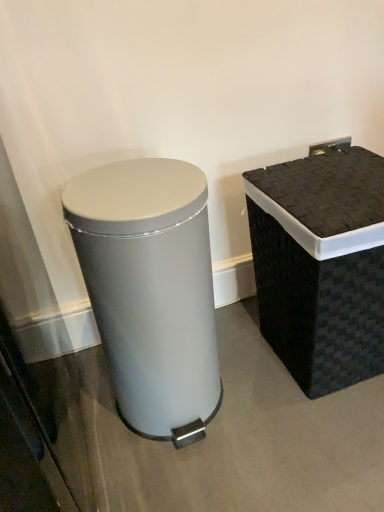
Where is `black woven basket at right, the first waste container viewed from the right`? black woven basket at right, the first waste container viewed from the right is located at coordinates (321, 264).

Describe the element at coordinates (321, 264) in the screenshot. Image resolution: width=384 pixels, height=512 pixels. I see `black woven basket at right, the first waste container viewed from the right` at that location.

At what (x,y) coordinates should I click in order to perform the action: click on satin silver trash can at left, marked as the second waste container in a right-to-left arrangement. Please return your answer as a coordinate pair (x, y). The width and height of the screenshot is (384, 512). Looking at the image, I should click on (151, 289).

What do you see at coordinates (151, 289) in the screenshot? I see `satin silver trash can at left, marked as the second waste container in a right-to-left arrangement` at bounding box center [151, 289].

At what (x,y) coordinates should I click in order to perform the action: click on black woven basket at right, the first waste container viewed from the right. Please return your answer as a coordinate pair (x, y). Image resolution: width=384 pixels, height=512 pixels. Looking at the image, I should click on (321, 264).

Is black woven basket at right, the first waste container viewed from the right, to the left or to the right of satin silver trash can at left, marked as the second waste container in a right-to-left arrangement, in the image?

black woven basket at right, the first waste container viewed from the right, is positioned on satin silver trash can at left, marked as the second waste container in a right-to-left arrangement,'s right side.

Considering the positions of objects black woven basket at right, the first waste container viewed from the right, and satin silver trash can at left, positioned as the first waste container in left-to-right order, in the image provided, who is in front, black woven basket at right, the first waste container viewed from the right, or satin silver trash can at left, positioned as the first waste container in left-to-right order,?

satin silver trash can at left, positioned as the first waste container in left-to-right order, is in front.

Which is in front, point (371, 244) or point (202, 435)?

The point (371, 244) is in front.

From the image's perspective, which object appears higher, black woven basket at right, the first waste container viewed from the right, or satin silver trash can at left, positioned as the first waste container in left-to-right order?

black woven basket at right, the first waste container viewed from the right, is shown above in the image.

From a real-world perspective, is black woven basket at right, the first waste container viewed from the right, located beneath satin silver trash can at left, positioned as the first waste container in left-to-right order?

Yes, from a real-world perspective, black woven basket at right, the first waste container viewed from the right, is under satin silver trash can at left, positioned as the first waste container in left-to-right order.

Does black woven basket at right, which is counted as the second waste container, starting from the left, have a lesser width compared to satin silver trash can at left, marked as the second waste container in a right-to-left arrangement?

Incorrect, the width of black woven basket at right, which is counted as the second waste container, starting from the left, is not less than that of satin silver trash can at left, marked as the second waste container in a right-to-left arrangement.

Is black woven basket at right, which is counted as the second waste container, starting from the left, taller than satin silver trash can at left, marked as the second waste container in a right-to-left arrangement?

No.

Which of these two, black woven basket at right, which is counted as the second waste container, starting from the left, or satin silver trash can at left, positioned as the first waste container in left-to-right order, is smaller?

Smaller between the two is satin silver trash can at left, positioned as the first waste container in left-to-right order.

Is black woven basket at right, the first waste container viewed from the right, not inside satin silver trash can at left, marked as the second waste container in a right-to-left arrangement?

That's correct, black woven basket at right, the first waste container viewed from the right, is outside of satin silver trash can at left, marked as the second waste container in a right-to-left arrangement.

Is black woven basket at right, the first waste container viewed from the right, touching satin silver trash can at left, marked as the second waste container in a right-to-left arrangement?

black woven basket at right, the first waste container viewed from the right, is not next to satin silver trash can at left, marked as the second waste container in a right-to-left arrangement, and they're not touching.

Is black woven basket at right, the first waste container viewed from the right, aimed at satin silver trash can at left, marked as the second waste container in a right-to-left arrangement?

No, black woven basket at right, the first waste container viewed from the right, is not turned towards satin silver trash can at left, marked as the second waste container in a right-to-left arrangement.

You are a GUI agent. You are given a task and a screenshot of the screen. Output one action in this format:
    pyautogui.click(x=<x>, y=<y>)
    Task: Click on the waste container behind the satin silver trash can at left, positioned as the first waste container in left-to-right order
    The height and width of the screenshot is (512, 384).
    Given the screenshot: What is the action you would take?
    pyautogui.click(x=321, y=264)

Does satin silver trash can at left, marked as the second waste container in a right-to-left arrangement, appear on the right side of black woven basket at right, the first waste container viewed from the right?

In fact, satin silver trash can at left, marked as the second waste container in a right-to-left arrangement, is to the left of black woven basket at right, the first waste container viewed from the right.

Based on the photo, does satin silver trash can at left, marked as the second waste container in a right-to-left arrangement, come behind black woven basket at right, the first waste container viewed from the right?

No, satin silver trash can at left, marked as the second waste container in a right-to-left arrangement, is closer to the camera.

Is point (110, 222) positioned behind point (271, 206)?

No, (110, 222) is in front of (271, 206).

From the image's perspective, is satin silver trash can at left, positioned as the first waste container in left-to-right order, above black woven basket at right, which is counted as the second waste container, starting from the left?

Incorrect, from the image's perspective, satin silver trash can at left, positioned as the first waste container in left-to-right order, is lower than black woven basket at right, which is counted as the second waste container, starting from the left.

From a real-world perspective, is satin silver trash can at left, positioned as the first waste container in left-to-right order, above or below black woven basket at right, which is counted as the second waste container, starting from the left?

From a real-world perspective, satin silver trash can at left, positioned as the first waste container in left-to-right order, is physically above black woven basket at right, which is counted as the second waste container, starting from the left.

Does satin silver trash can at left, marked as the second waste container in a right-to-left arrangement, have a greater width compared to black woven basket at right, the first waste container viewed from the right?

No, satin silver trash can at left, marked as the second waste container in a right-to-left arrangement, is not wider than black woven basket at right, the first waste container viewed from the right.

Which of these two, satin silver trash can at left, positioned as the first waste container in left-to-right order, or black woven basket at right, the first waste container viewed from the right, stands shorter?

black woven basket at right, the first waste container viewed from the right.

Considering the sizes of satin silver trash can at left, positioned as the first waste container in left-to-right order, and black woven basket at right, the first waste container viewed from the right, in the image, is satin silver trash can at left, positioned as the first waste container in left-to-right order, bigger or smaller than black woven basket at right, the first waste container viewed from the right,?

Clearly, satin silver trash can at left, positioned as the first waste container in left-to-right order, is smaller in size than black woven basket at right, the first waste container viewed from the right.

Is satin silver trash can at left, marked as the second waste container in a right-to-left arrangement, situated inside black woven basket at right, the first waste container viewed from the right, or outside?

satin silver trash can at left, marked as the second waste container in a right-to-left arrangement, is outside black woven basket at right, the first waste container viewed from the right.

Can you see satin silver trash can at left, positioned as the first waste container in left-to-right order, touching black woven basket at right, which is counted as the second waste container, starting from the left?

satin silver trash can at left, positioned as the first waste container in left-to-right order, is not next to black woven basket at right, which is counted as the second waste container, starting from the left, and they're not touching.

Is black woven basket at right, which is counted as the second waste container, starting from the left, at the back of satin silver trash can at left, marked as the second waste container in a right-to-left arrangement?

No.

Identify the location of waste container lying below the black woven basket at right, which is counted as the second waste container, starting from the left (from the image's perspective). The image size is (384, 512). (151, 289).

You are a GUI agent. You are given a task and a screenshot of the screen. Output one action in this format:
    pyautogui.click(x=<x>, y=<y>)
    Task: Click on the waste container located on the left of black woven basket at right, which is counted as the second waste container, starting from the left
    This screenshot has height=512, width=384.
    Given the screenshot: What is the action you would take?
    pyautogui.click(x=151, y=289)

Where is `waste container on the right of satin silver trash can at left, marked as the second waste container in a right-to-left arrangement`? waste container on the right of satin silver trash can at left, marked as the second waste container in a right-to-left arrangement is located at coordinates (321, 264).